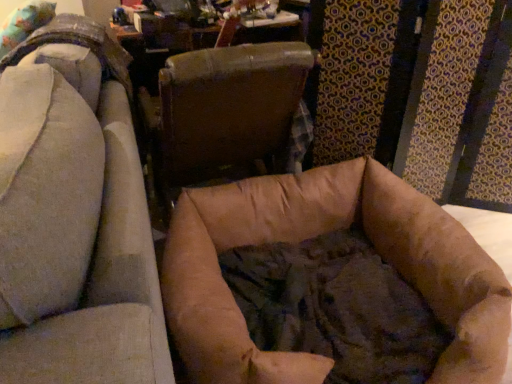
How much space does brown fabric dog bed at center, positioned as the 2th chair in right-to-left order, occupy vertically?

36.66 inches.

The height and width of the screenshot is (384, 512). What are the coordinates of `brown fabric dog bed at center, acting as the 1th chair starting from the left` in the screenshot? It's located at (75, 218).

What do you see at coordinates (75, 218) in the screenshot?
I see `brown fabric dog bed at center, acting as the 1th chair starting from the left` at bounding box center [75, 218].

Describe the element at coordinates (223, 114) in the screenshot. The width and height of the screenshot is (512, 384). I see `brown leather chair at center, arranged as the first chair when viewed from the right` at that location.

The height and width of the screenshot is (384, 512). Find the location of `brown leather chair at center, arranged as the first chair when viewed from the right`. brown leather chair at center, arranged as the first chair when viewed from the right is located at coordinates (223, 114).

Where is `brown fabric dog bed at center, acting as the 1th chair starting from the left`? The width and height of the screenshot is (512, 384). brown fabric dog bed at center, acting as the 1th chair starting from the left is located at coordinates (75, 218).

Does brown leather chair at center, the second chair positioned from the left, appear on the right side of brown fabric dog bed at center, acting as the 1th chair starting from the left?

Yes.

Between brown leather chair at center, the second chair positioned from the left, and brown fabric dog bed at center, acting as the 1th chair starting from the left, which one is positioned behind?

brown leather chair at center, the second chair positioned from the left, is behind.

Which is farther from the camera, (209,65) or (57,83)?

The point (209,65) is farther.

From the image's perspective, would you say brown leather chair at center, the second chair positioned from the left, is shown under brown fabric dog bed at center, acting as the 1th chair starting from the left?

No.

From a real-world perspective, does brown leather chair at center, the second chair positioned from the left, stand above brown fabric dog bed at center, positioned as the 2th chair in right-to-left order?

No, from a real-world perspective, brown leather chair at center, the second chair positioned from the left, is not above brown fabric dog bed at center, positioned as the 2th chair in right-to-left order.

Is brown leather chair at center, the second chair positioned from the left, thinner than brown fabric dog bed at center, positioned as the 2th chair in right-to-left order?

Yes.

From the picture: Does brown leather chair at center, the second chair positioned from the left, have a lesser height compared to brown fabric dog bed at center, acting as the 1th chair starting from the left?

Indeed, brown leather chair at center, the second chair positioned from the left, has a lesser height compared to brown fabric dog bed at center, acting as the 1th chair starting from the left.

Considering the relative sizes of brown leather chair at center, arranged as the first chair when viewed from the right, and brown fabric dog bed at center, acting as the 1th chair starting from the left, in the image provided, is brown leather chair at center, arranged as the first chair when viewed from the right, bigger than brown fabric dog bed at center, acting as the 1th chair starting from the left,?

Actually, brown leather chair at center, arranged as the first chair when viewed from the right, might be smaller than brown fabric dog bed at center, acting as the 1th chair starting from the left.

Is brown leather chair at center, arranged as the first chair when viewed from the right, not inside brown fabric dog bed at center, positioned as the 2th chair in right-to-left order?

brown leather chair at center, arranged as the first chair when viewed from the right, lies outside brown fabric dog bed at center, positioned as the 2th chair in right-to-left order,'s area.

Are brown leather chair at center, the second chair positioned from the left, and brown fabric dog bed at center, positioned as the 2th chair in right-to-left order, located far from each other?

They are positioned close to each other.

Is brown leather chair at center, arranged as the first chair when viewed from the right, turned away from brown fabric dog bed at center, acting as the 1th chair starting from the left?

No, brown leather chair at center, arranged as the first chair when viewed from the right, is not facing the opposite direction of brown fabric dog bed at center, acting as the 1th chair starting from the left.

Measure the distance from brown leather chair at center, arranged as the first chair when viewed from the right, to brown fabric dog bed at center, positioned as the 2th chair in right-to-left order.

brown leather chair at center, arranged as the first chair when viewed from the right, and brown fabric dog bed at center, positioned as the 2th chair in right-to-left order, are 51.28 centimeters apart from each other.

You are a GUI agent. You are given a task and a screenshot of the screen. Output one action in this format:
    pyautogui.click(x=<x>, y=<y>)
    Task: Click on the chair that appears behind the brown fabric dog bed at center, acting as the 1th chair starting from the left
    
    Given the screenshot: What is the action you would take?
    pyautogui.click(x=223, y=114)

Based on the photo, can you confirm if brown fabric dog bed at center, acting as the 1th chair starting from the left, is positioned to the right of brown leather chair at center, arranged as the first chair when viewed from the right?

No, brown fabric dog bed at center, acting as the 1th chair starting from the left, is not to the right of brown leather chair at center, arranged as the first chair when viewed from the right.

Is brown fabric dog bed at center, acting as the 1th chair starting from the left, in front of brown leather chair at center, arranged as the first chair when viewed from the right?

Yes, it is in front of brown leather chair at center, arranged as the first chair when viewed from the right.

Considering the points (14, 330) and (236, 148), which point is in front, point (14, 330) or point (236, 148)?

The point (14, 330) is in front.

From the image's perspective, who appears lower, brown fabric dog bed at center, acting as the 1th chair starting from the left, or brown leather chair at center, arranged as the first chair when viewed from the right?

brown fabric dog bed at center, acting as the 1th chair starting from the left, from the image's perspective.

From a real-world perspective, relative to brown leather chair at center, the second chair positioned from the left, is brown fabric dog bed at center, positioned as the 2th chair in right-to-left order, vertically above or below?

In terms of real-world spatial position, brown fabric dog bed at center, positioned as the 2th chair in right-to-left order, is above brown leather chair at center, the second chair positioned from the left.

Which of these two, brown fabric dog bed at center, acting as the 1th chair starting from the left, or brown leather chair at center, arranged as the first chair when viewed from the right, is thinner?

With smaller width is brown leather chair at center, arranged as the first chair when viewed from the right.

Can you confirm if brown fabric dog bed at center, positioned as the 2th chair in right-to-left order, is taller than brown leather chair at center, arranged as the first chair when viewed from the right?

Indeed, brown fabric dog bed at center, positioned as the 2th chair in right-to-left order, has a greater height compared to brown leather chair at center, arranged as the first chair when viewed from the right.

Which of these two, brown fabric dog bed at center, acting as the 1th chair starting from the left, or brown leather chair at center, the second chair positioned from the left, is smaller?

With smaller size is brown leather chair at center, the second chair positioned from the left.

Could brown leather chair at center, the second chair positioned from the left, be considered to be inside brown fabric dog bed at center, positioned as the 2th chair in right-to-left order?

No, brown leather chair at center, the second chair positioned from the left, is not inside brown fabric dog bed at center, positioned as the 2th chair in right-to-left order.

Is brown fabric dog bed at center, acting as the 1th chair starting from the left, next to brown leather chair at center, arranged as the first chair when viewed from the right, and touching it?

brown fabric dog bed at center, acting as the 1th chair starting from the left, and brown leather chair at center, arranged as the first chair when viewed from the right, are not in contact.

From the picture: Is brown fabric dog bed at center, positioned as the 2th chair in right-to-left order, facing away from brown leather chair at center, the second chair positioned from the left?

Absolutely, brown fabric dog bed at center, positioned as the 2th chair in right-to-left order, is directed away from brown leather chair at center, the second chair positioned from the left.

From the picture: What's the angular difference between brown fabric dog bed at center, positioned as the 2th chair in right-to-left order, and brown leather chair at center, the second chair positioned from the left,'s facing directions?

There is a 85.8-degree angle between the facing directions of brown fabric dog bed at center, positioned as the 2th chair in right-to-left order, and brown leather chair at center, the second chair positioned from the left.

This screenshot has width=512, height=384. Find the location of `chair behind the brown fabric dog bed at center, acting as the 1th chair starting from the left`. chair behind the brown fabric dog bed at center, acting as the 1th chair starting from the left is located at coordinates (x=223, y=114).

Locate an element on the screen. chair lying behind the brown fabric dog bed at center, positioned as the 2th chair in right-to-left order is located at coordinates (223, 114).

The height and width of the screenshot is (384, 512). In order to click on chair located below the brown leather chair at center, arranged as the first chair when viewed from the right (from the image's perspective) in this screenshot , I will do `click(75, 218)`.